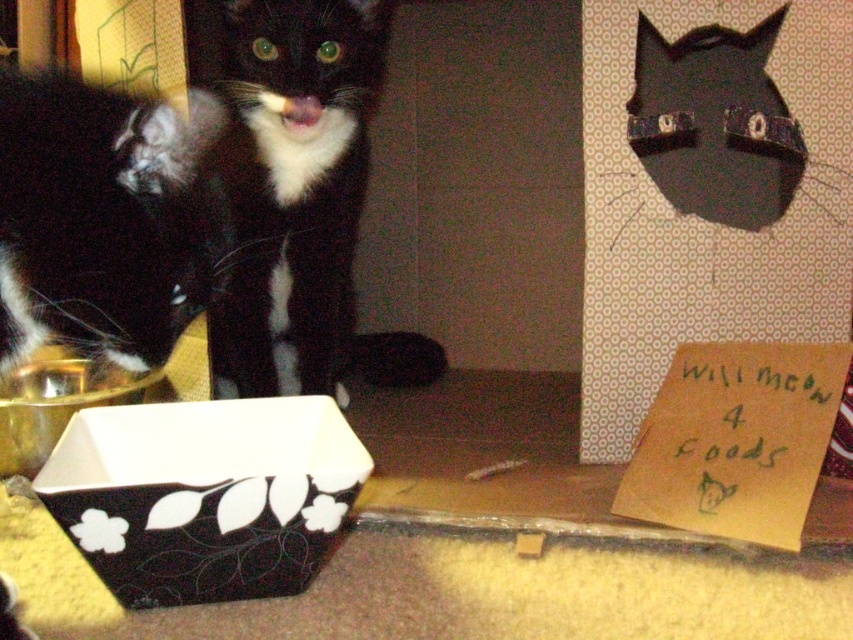
Is black matte fur cat at center smaller than black matte box at lower left?

No.

How much distance is there between black matte fur cat at center and black matte box at lower left?

A distance of 13.21 inches exists between black matte fur cat at center and black matte box at lower left.

Is point (296, 234) behind point (136, 541)?

Yes, point (296, 234) is farther from viewer.

This screenshot has height=640, width=853. I want to click on black matte fur cat at center, so click(299, 200).

Does black matte fur cat at center appear on the left side of black fur cat at left?

In fact, black matte fur cat at center is to the right of black fur cat at left.

From the picture: Which of these two, black matte fur cat at center or black fur cat at left, stands shorter?

black fur cat at left is shorter.

This screenshot has width=853, height=640. What are the coordinates of `black matte fur cat at center` in the screenshot? It's located at (299, 200).

Looking at this image, which of these two, black matte fur cat at center or yellow cardboard at lower right, stands taller?

Standing taller between the two is black matte fur cat at center.

The image size is (853, 640). What do you see at coordinates (299, 200) in the screenshot? I see `black matte fur cat at center` at bounding box center [299, 200].

The image size is (853, 640). I want to click on black matte fur cat at center, so click(299, 200).